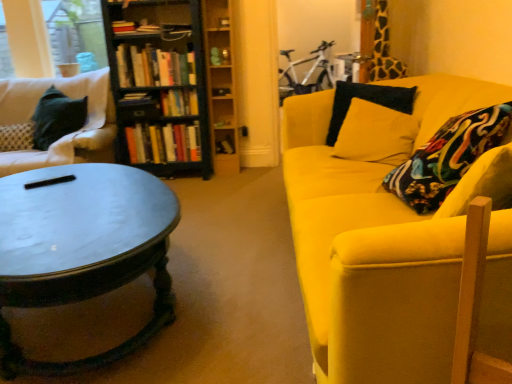
This screenshot has height=384, width=512. What are the coordinates of `unoccupied region to the right of matte black coffee table at left` in the screenshot? It's located at (240, 275).